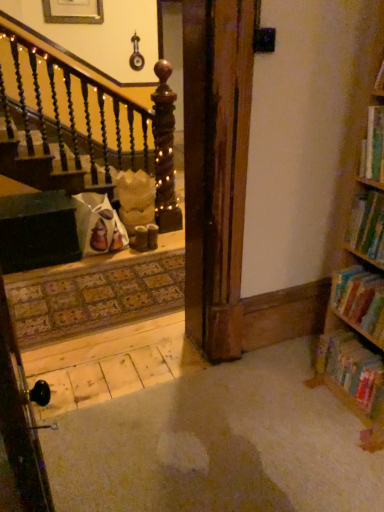
Question: Is green matte bookshelf at right, which ranks as the second book in top-to-bottom order, far from hardcover book at right, which appears as the 3th book when viewed from the top?

Choices:
 (A) yes
 (B) no

Answer: (B)

Question: From a real-world perspective, is green matte bookshelf at right, which is the third book from bottom to top, physically below hardcover book at right, which appears as the 3th book when viewed from the top?

Choices:
 (A) no
 (B) yes

Answer: (A)

Question: Is green matte bookshelf at right, which is the third book from bottom to top, outside of hardcover book at right, marked as the second book in a bottom-to-top arrangement?

Choices:
 (A) yes
 (B) no

Answer: (A)

Question: Would you say hardcover book at right, which appears as the 3th book when viewed from the top, is part of green matte bookshelf at right, which is the third book from bottom to top,'s contents?

Choices:
 (A) no
 (B) yes

Answer: (A)

Question: From the image's perspective, is green matte bookshelf at right, which ranks as the second book in top-to-bottom order, under hardcover book at right, marked as the second book in a bottom-to-top arrangement?

Choices:
 (A) yes
 (B) no

Answer: (B)

Question: Is point (362, 268) positioned closer to the camera than point (350, 230)?

Choices:
 (A) farther
 (B) closer

Answer: (A)

Question: Considering the positions of hardcover book at right, which appears as the 3th book when viewed from the top, and green matte bookshelf at right, which ranks as the second book in top-to-bottom order, in the image, is hardcover book at right, which appears as the 3th book when viewed from the top, bigger or smaller than green matte bookshelf at right, which ranks as the second book in top-to-bottom order,?

Choices:
 (A) small
 (B) big

Answer: (B)

Question: Is hardcover book at right, marked as the second book in a bottom-to-top arrangement, wider or thinner than green matte bookshelf at right, which is the third book from bottom to top?

Choices:
 (A) thin
 (B) wide

Answer: (B)

Question: From a real-world perspective, is hardcover book at right, marked as the second book in a bottom-to-top arrangement, physically located above or below green matte bookshelf at right, which ranks as the second book in top-to-bottom order?

Choices:
 (A) above
 (B) below

Answer: (B)

Question: Considering the positions of point (342, 336) and point (354, 249), is point (342, 336) closer or farther from the camera than point (354, 249)?

Choices:
 (A) farther
 (B) closer

Answer: (A)

Question: From a real-world perspective, is multicolored cardboard book at lower right, which is the 4th book from top to bottom, above or below green matte bookshelf at right, which is the third book from bottom to top?

Choices:
 (A) below
 (B) above

Answer: (A)

Question: Considering the positions of multicolored cardboard book at lower right, which is the 4th book from top to bottom, and green matte bookshelf at right, which is the third book from bottom to top, in the image, is multicolored cardboard book at lower right, which is the 4th book from top to bottom, wider or thinner than green matte bookshelf at right, which is the third book from bottom to top,?

Choices:
 (A) thin
 (B) wide

Answer: (B)

Question: From the image's perspective, relative to green matte bookshelf at right, which ranks as the second book in top-to-bottom order, is multicolored cardboard book at lower right, which is the 4th book from top to bottom, above or below?

Choices:
 (A) below
 (B) above

Answer: (A)

Question: From the image's perspective, is green matte bookshelf at right, which ranks as the second book in top-to-bottom order, positioned above or below multicolored cardboard book at lower right, arranged as the first book when ordered from the bottom?

Choices:
 (A) above
 (B) below

Answer: (A)

Question: Is point (349, 221) positioned closer to the camera than point (354, 392)?

Choices:
 (A) closer
 (B) farther

Answer: (A)